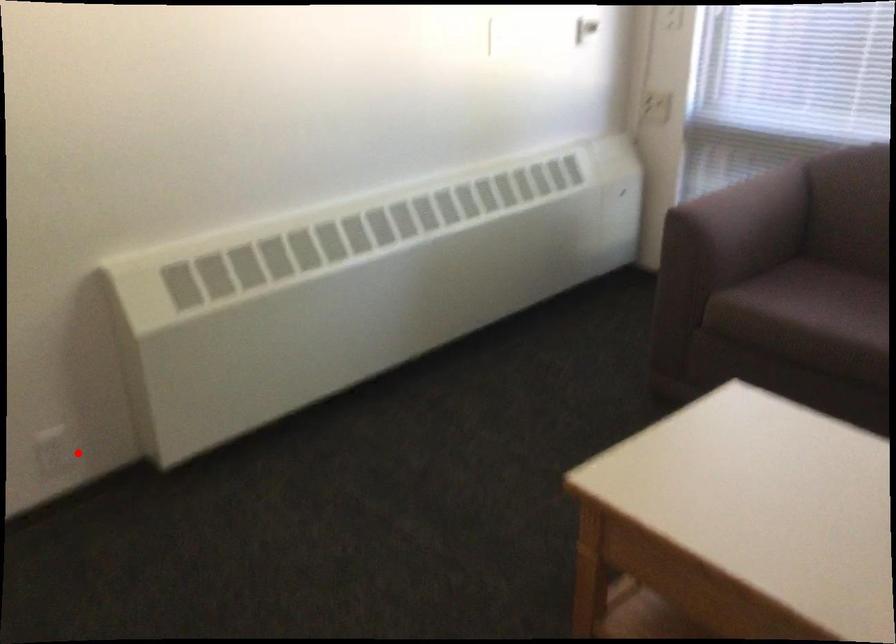
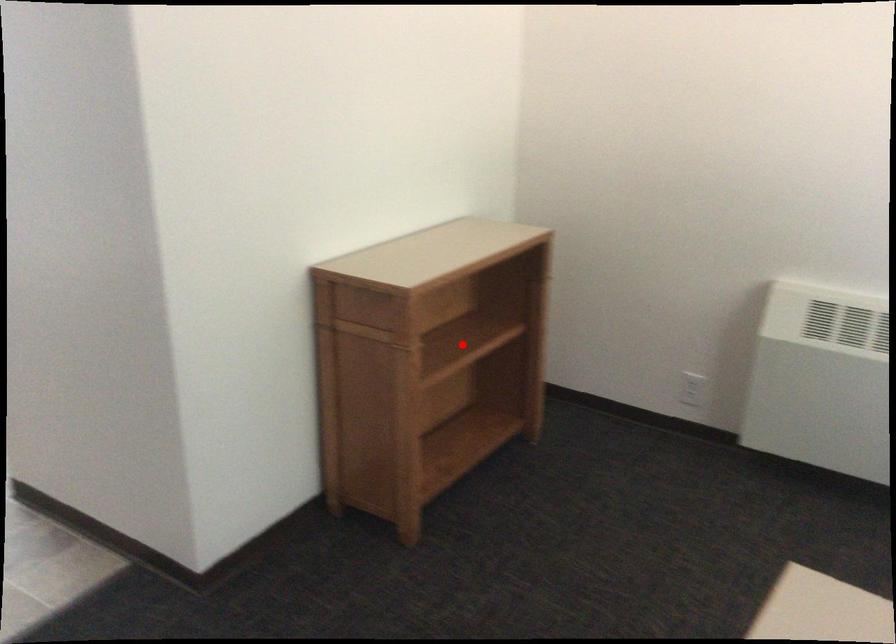
I am providing you with two images of the same scene from different viewpoints. A red point is marked on the first image and another point is marked on the second image. Is the red point in image1 aligned with the point shown in image2?

No